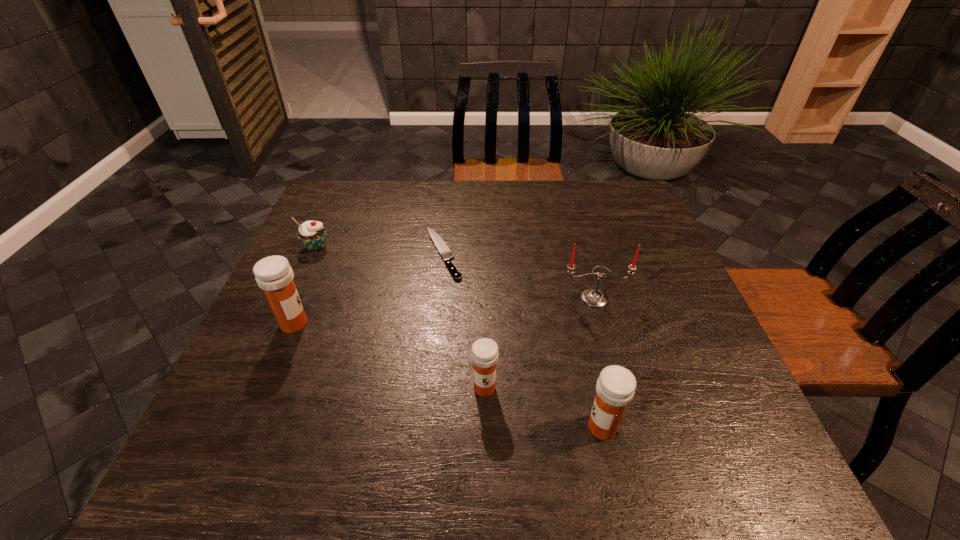
At what (x,y) coordinates should I click in order to perform the action: click on the third nearest object. Please return your answer as a coordinate pair (x, y). The width and height of the screenshot is (960, 540). Looking at the image, I should click on (273, 274).

I want to click on the leftmost medicine, so (x=273, y=274).

Locate an element on the screen. This screenshot has height=540, width=960. the shortest medicine is located at coordinates (484, 353).

You are a GUI agent. You are given a task and a screenshot of the screen. Output one action in this format:
    pyautogui.click(x=<x>, y=<y>)
    Task: Click on the fifth farthest object
    The image size is (960, 540).
    Given the screenshot: What is the action you would take?
    pyautogui.click(x=484, y=353)

Where is `the rightmost medicine`? The height and width of the screenshot is (540, 960). the rightmost medicine is located at coordinates (615, 387).

At what (x,y) coordinates should I click in order to perform the action: click on the nearest medicine. Please return your answer as a coordinate pair (x, y). The image size is (960, 540). Looking at the image, I should click on (615, 387).

Identify the location of the fourth nearest object. The image size is (960, 540). (593, 297).

The image size is (960, 540). I want to click on cupcake, so click(x=312, y=234).

You are a GUI agent. You are given a task and a screenshot of the screen. Output one action in this format:
    pyautogui.click(x=<x>, y=<y>)
    Task: Click on the steak knife
    The height and width of the screenshot is (540, 960).
    Given the screenshot: What is the action you would take?
    pyautogui.click(x=445, y=252)

Where is `the shortest object`? The height and width of the screenshot is (540, 960). the shortest object is located at coordinates (445, 252).